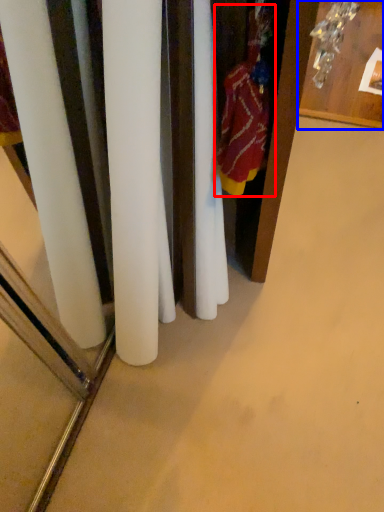
Question: Which of the following is the farthest to the observer, clothing (highlighted by a red box) or furniture (highlighted by a blue box)?

Choices:
 (A) clothing
 (B) furniture

Answer: (B)